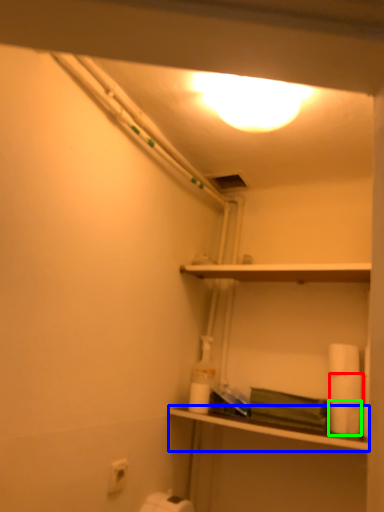
Question: Which object is the farthest from toilet paper (highlighted by a red box)? Choose among these: shelf (highlighted by a blue box) or toilet paper (highlighted by a green box).

Choices:
 (A) shelf
 (B) toilet paper

Answer: (A)